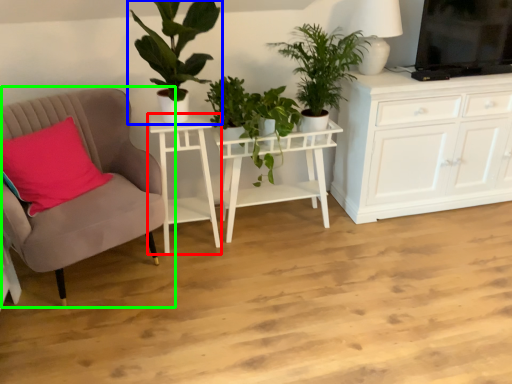
Question: Considering the real-world distances, which object is closest to table (highlighted by a red box)? houseplant (highlighted by a blue box) or chair (highlighted by a green box).

Choices:
 (A) houseplant
 (B) chair

Answer: (B)